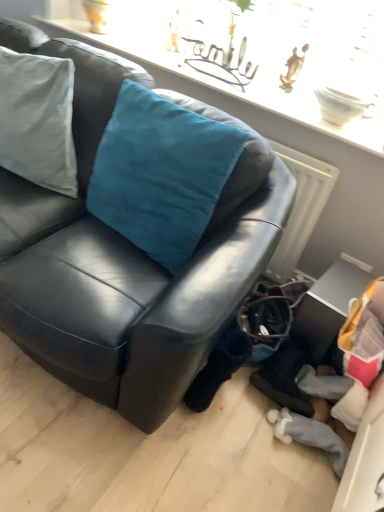
Question: Considering the relative sizes of teal velvet cushion at upper left and black leather couch at center in the image provided, is teal velvet cushion at upper left taller than black leather couch at center?

Choices:
 (A) yes
 (B) no

Answer: (B)

Question: Is teal velvet cushion at upper left thinner than black leather couch at center?

Choices:
 (A) no
 (B) yes

Answer: (B)

Question: Can you confirm if teal velvet cushion at upper left is wider than black leather couch at center?

Choices:
 (A) no
 (B) yes

Answer: (A)

Question: Does teal velvet cushion at upper left come in front of black leather couch at center?

Choices:
 (A) no
 (B) yes

Answer: (A)

Question: Is teal velvet cushion at upper left facing towards black leather couch at center?

Choices:
 (A) yes
 (B) no

Answer: (A)

Question: From the image's perspective, is teal velvet cushion at upper left located above or below metallic silver table at lower right?

Choices:
 (A) below
 (B) above

Answer: (B)

Question: Considering the positions of teal velvet cushion at upper left and metallic silver table at lower right in the image, is teal velvet cushion at upper left wider or thinner than metallic silver table at lower right?

Choices:
 (A) thin
 (B) wide

Answer: (A)

Question: In the image, is teal velvet cushion at upper left positioned in front of or behind metallic silver table at lower right?

Choices:
 (A) behind
 (B) front

Answer: (B)

Question: Is teal velvet cushion at upper left bigger or smaller than metallic silver table at lower right?

Choices:
 (A) big
 (B) small

Answer: (A)

Question: Is metallic silver table at lower right inside or outside of black leather couch at center?

Choices:
 (A) outside
 (B) inside

Answer: (A)

Question: In the image, is metallic silver table at lower right on the left side or the right side of black leather couch at center?

Choices:
 (A) right
 (B) left

Answer: (A)

Question: In the image, is metallic silver table at lower right positioned in front of or behind black leather couch at center?

Choices:
 (A) front
 (B) behind

Answer: (B)

Question: In terms of size, does metallic silver table at lower right appear bigger or smaller than black leather couch at center?

Choices:
 (A) small
 (B) big

Answer: (A)

Question: Do you think satin teal cushion at upper center is within metallic silver table at lower right, or outside of it?

Choices:
 (A) outside
 (B) inside

Answer: (A)

Question: From a real-world perspective, is satin teal cushion at upper center physically located above or below metallic silver table at lower right?

Choices:
 (A) above
 (B) below

Answer: (A)